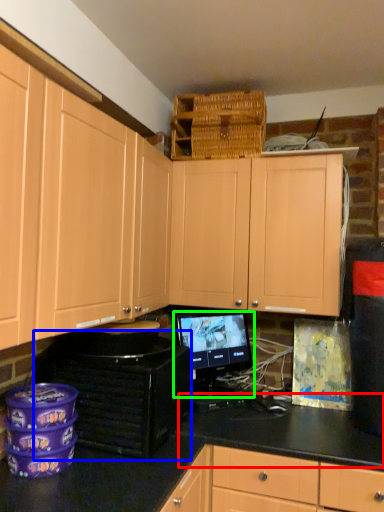
Question: Considering the real-world distances, which object is farthest from counter top (highlighted by a red box)? appliance (highlighted by a blue box) or computer monitor (highlighted by a green box)?

Choices:
 (A) appliance
 (B) computer monitor

Answer: (A)